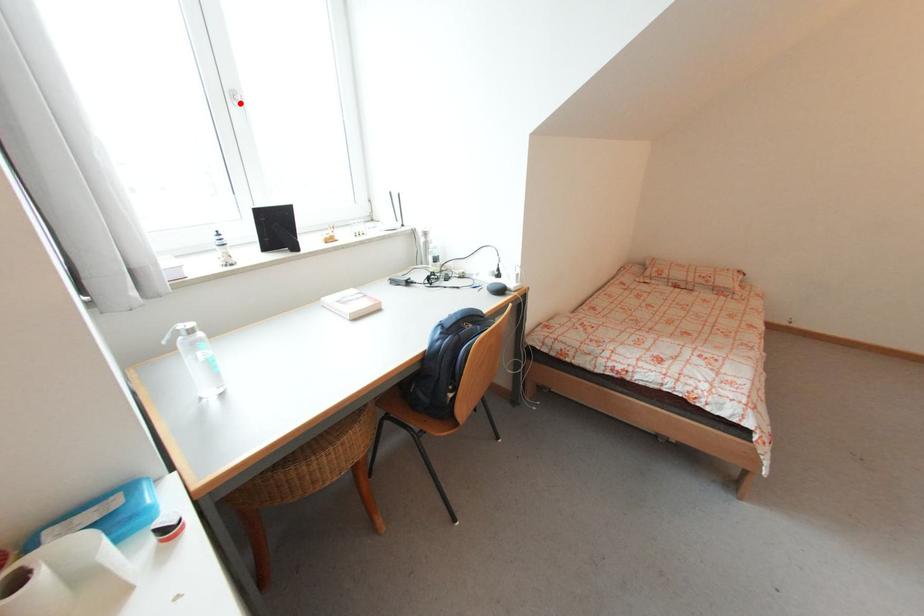
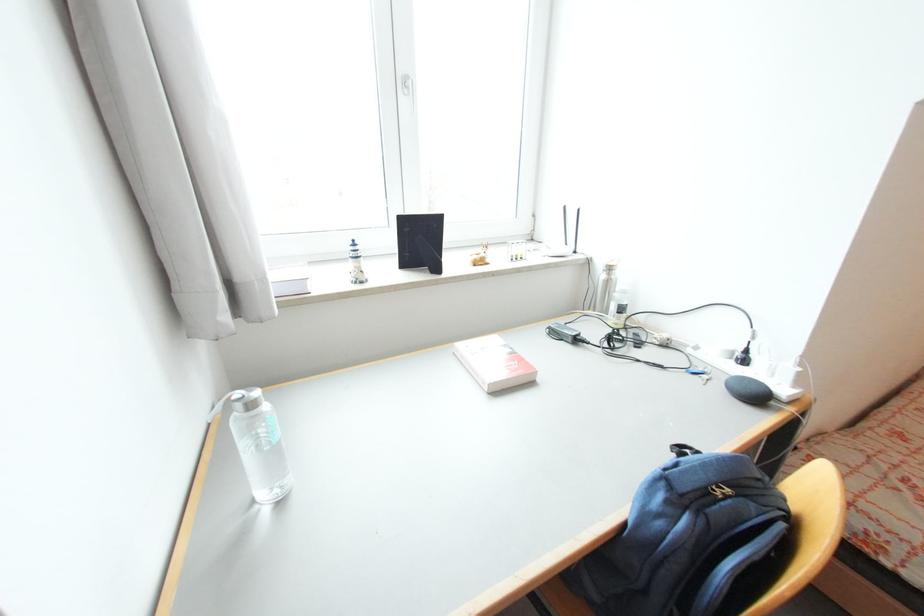
The point at the highlighted location is marked in the first image. Where is the corresponding point in the second image?

(411, 91)